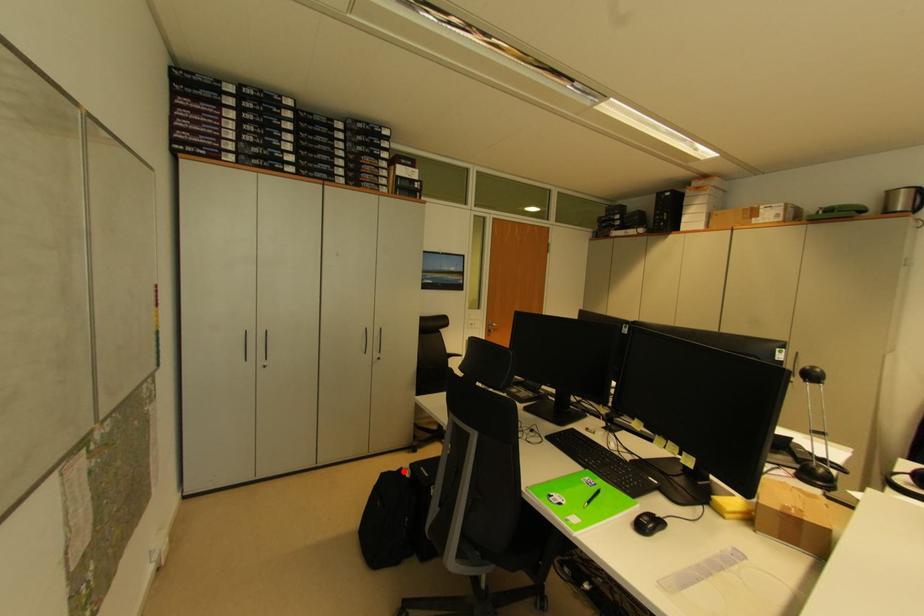
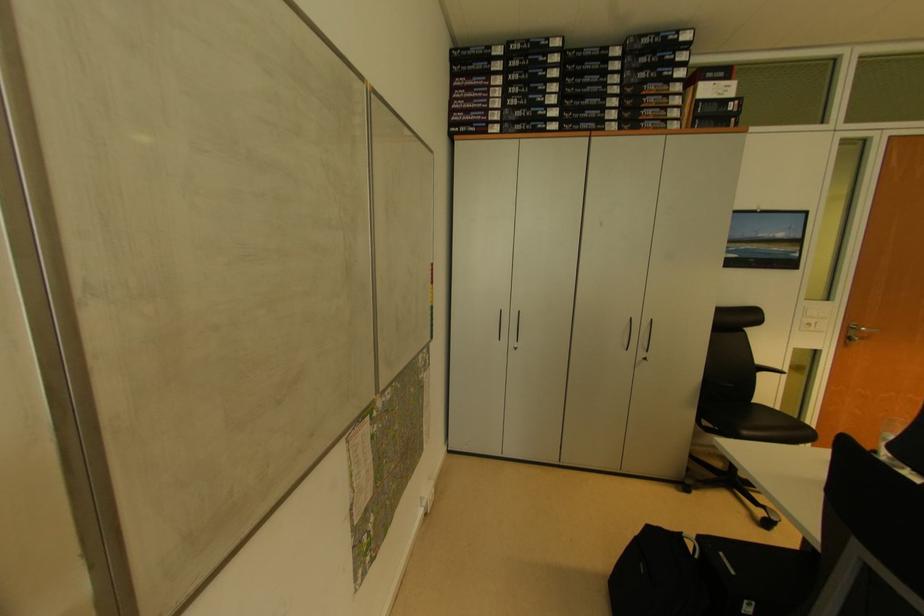
Locate, in the second image, the point that corresponds to the highlighted location in the first image.

(684, 536)